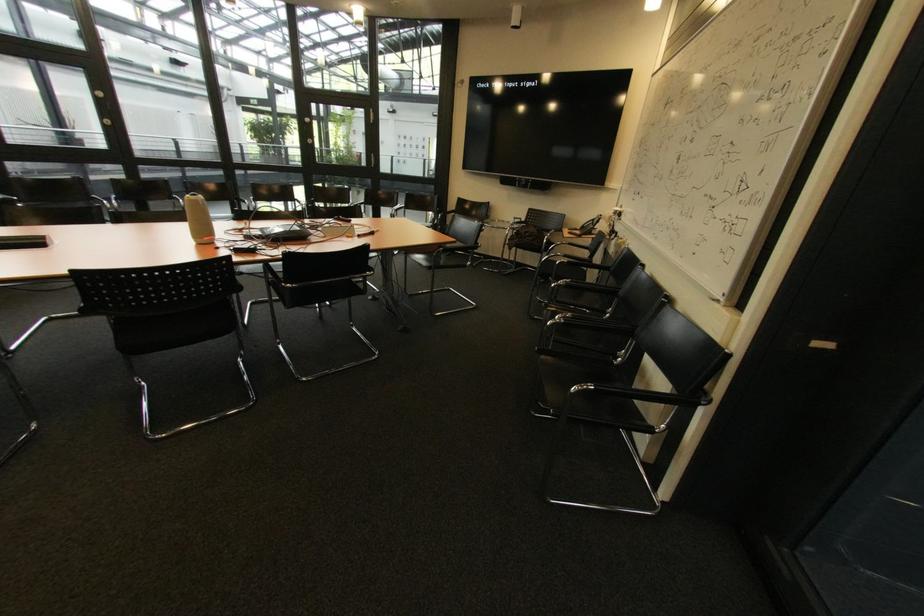
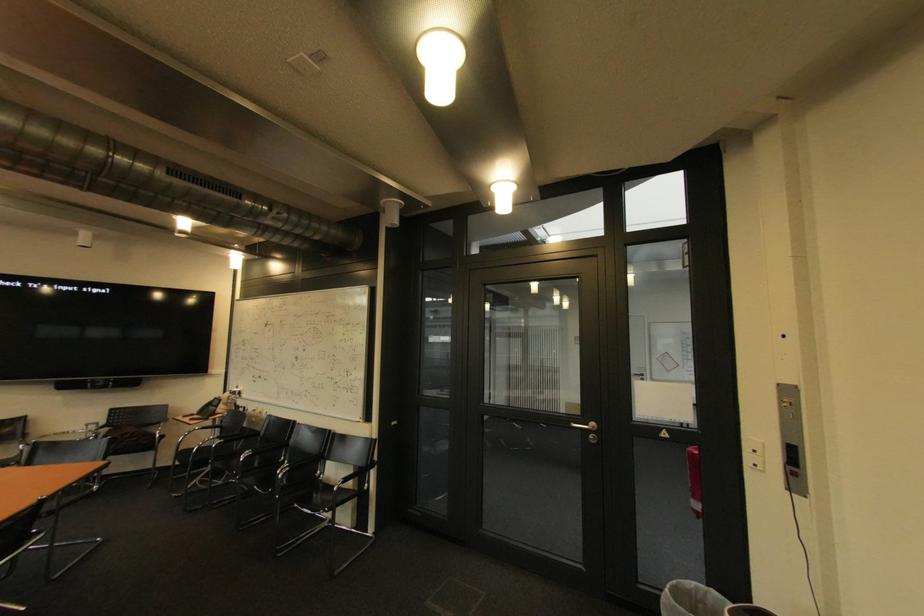
In the second image, find the point that corresponds to (x=562, y=286) in the first image.

(250, 460)